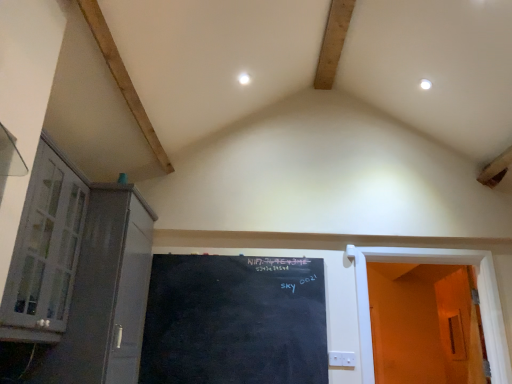
Question: From the image's perspective, is white glass cabinet at left located above black chalkboard at center?

Choices:
 (A) yes
 (B) no

Answer: (A)

Question: Is black chalkboard at center inside white glass cabinet at left?

Choices:
 (A) no
 (B) yes

Answer: (A)

Question: Considering the relative sizes of white glass cabinet at left and black chalkboard at center in the image provided, is white glass cabinet at left thinner than black chalkboard at center?

Choices:
 (A) no
 (B) yes

Answer: (A)

Question: Considering the relative sizes of white glass cabinet at left and black chalkboard at center in the image provided, is white glass cabinet at left smaller than black chalkboard at center?

Choices:
 (A) no
 (B) yes

Answer: (A)

Question: From a real-world perspective, is white glass cabinet at left on top of black chalkboard at center?

Choices:
 (A) no
 (B) yes

Answer: (B)

Question: Does point (423, 248) appear closer or farther from the camera than point (79, 311)?

Choices:
 (A) farther
 (B) closer

Answer: (A)

Question: Would you say white wooden door at right, the 2th door viewed from the right, is to the left or to the right of matte gray cabinet at left in the picture?

Choices:
 (A) left
 (B) right

Answer: (B)

Question: Is white wooden door at right, which is counted as the 1th door, starting from the left, inside or outside of matte gray cabinet at left?

Choices:
 (A) outside
 (B) inside

Answer: (A)

Question: Is white wooden door at right, which is counted as the 1th door, starting from the left, bigger or smaller than matte gray cabinet at left?

Choices:
 (A) small
 (B) big

Answer: (A)

Question: In the image, is white glass cabinet at left positioned in front of or behind orange matte door at right, the 1th door viewed from the right?

Choices:
 (A) front
 (B) behind

Answer: (A)

Question: Which is correct: white glass cabinet at left is inside orange matte door at right, the 1th door viewed from the right, or outside of it?

Choices:
 (A) outside
 (B) inside

Answer: (A)

Question: From their relative heights in the image, would you say white glass cabinet at left is taller or shorter than orange matte door at right, the 1th door viewed from the right?

Choices:
 (A) tall
 (B) short

Answer: (A)

Question: From a real-world perspective, is white glass cabinet at left physically located above or below orange matte door at right, the 1th door viewed from the right?

Choices:
 (A) above
 (B) below

Answer: (A)

Question: From the image's perspective, is white wooden door at right, the 2th door viewed from the right, positioned above or below white glass cabinet at left?

Choices:
 (A) above
 (B) below

Answer: (B)

Question: Considering the relative positions of white wooden door at right, which is counted as the 1th door, starting from the left, and white glass cabinet at left in the image provided, is white wooden door at right, which is counted as the 1th door, starting from the left, to the left or to the right of white glass cabinet at left?

Choices:
 (A) left
 (B) right

Answer: (B)